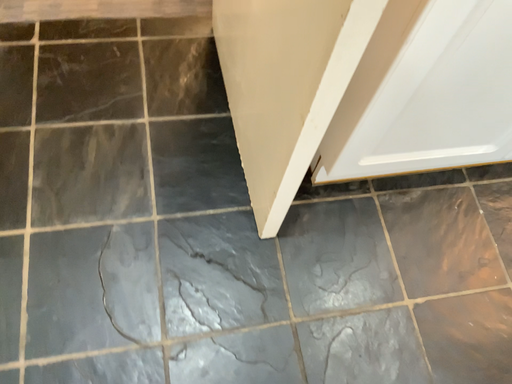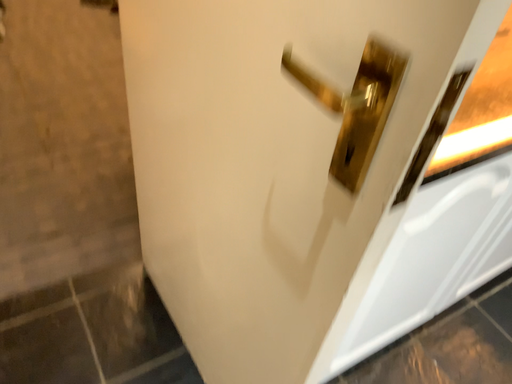
Question: Which way did the camera rotate in the video?

Choices:
 (A) rotated upward
 (B) rotated downward

Answer: (A)